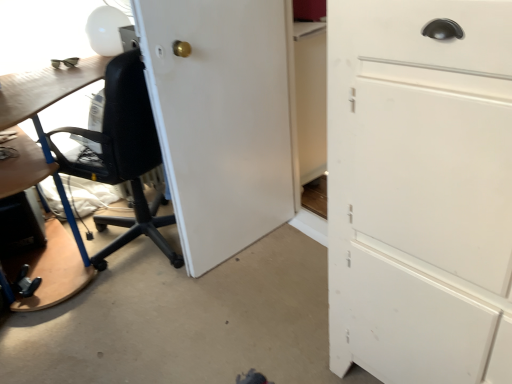
Question: Is white glossy table lamp at upper left oriented away from white matte cabinet at right?

Choices:
 (A) no
 (B) yes

Answer: (A)

Question: From the image's perspective, is white glossy table lamp at upper left above white matte cabinet at right?

Choices:
 (A) no
 (B) yes

Answer: (B)

Question: From the image's perspective, is white glossy table lamp at upper left beneath white matte cabinet at right?

Choices:
 (A) yes
 (B) no

Answer: (B)

Question: Would you say white glossy table lamp at upper left is outside white matte cabinet at right?

Choices:
 (A) yes
 (B) no

Answer: (A)

Question: Is white glossy table lamp at upper left bigger than white matte cabinet at right?

Choices:
 (A) no
 (B) yes

Answer: (A)

Question: Is point (165, 102) closer or farther from the camera than point (88, 34)?

Choices:
 (A) closer
 (B) farther

Answer: (A)

Question: From a real-world perspective, relative to white glossy table lamp at upper left, is white matte door at center vertically above or below?

Choices:
 (A) above
 (B) below

Answer: (B)

Question: Is white matte door at center inside the boundaries of white glossy table lamp at upper left, or outside?

Choices:
 (A) outside
 (B) inside

Answer: (A)

Question: Is white matte door at center wider or thinner than white glossy table lamp at upper left?

Choices:
 (A) wide
 (B) thin

Answer: (B)

Question: Is white matte cabinet at right in front of or behind white matte door at center in the image?

Choices:
 (A) front
 (B) behind

Answer: (A)

Question: In terms of height, does white matte cabinet at right look taller or shorter compared to white matte door at center?

Choices:
 (A) short
 (B) tall

Answer: (B)

Question: From a real-world perspective, relative to white matte door at center, is white matte cabinet at right vertically above or below?

Choices:
 (A) above
 (B) below

Answer: (A)

Question: Would you say white matte cabinet at right is inside or outside white matte door at center?

Choices:
 (A) inside
 (B) outside

Answer: (B)

Question: From a real-world perspective, is white matte cabinet at right physically located above or below white glossy table lamp at upper left?

Choices:
 (A) above
 (B) below

Answer: (B)

Question: From the image's perspective, is white matte cabinet at right positioned above or below white glossy table lamp at upper left?

Choices:
 (A) above
 (B) below

Answer: (B)